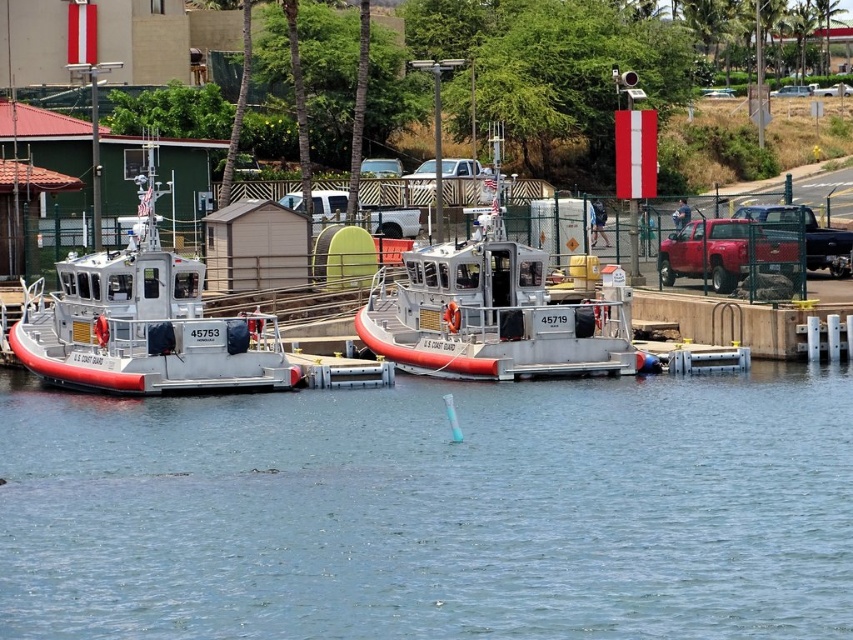
In the scene shown: You are a Coast Guard officer planning to move a 8.5 meter long cargo container between the white rubber boat at left and the white matte boat at center. Based on the distance between them, can the container fit through the space without needing to move either boat?

The white rubber boat at left and the white matte boat at center are 7.97 meters apart from each other. Since the cargo container is 8.5 meters long, it cannot fit through the space between them without moving at least one of the boats.

You are a Coast Guard officer planning to launch a boat from the pier. You need to choose between the white rubber boat at left and the white matte boat at center. Which boat should you choose if you need a larger vessel for a rescue operation?

The white matte boat at center is larger than the white rubber boat at left, so you should choose the white matte boat at center for the rescue operation.

You are a drone operator tasked with capturing aerial footage of the waterfront scene. The drone needs to hover above the transparent water at center to capture a clear reflection of the boats. Given that the drone is currently at coordinates point A, which is at point A coordinates are at point A coordinates are at point A coordinates are at point A coordinates are at point A coordinates are at point A coordinates are at point A coordinates are at point A coordinates are at point A coordinates are at point

The transparent water at center is located at point coordinates point coordinates are at point coordinates are at point coordinates are at point coordinates are at point coordinates are at point coordinates are at point coordinates are at point coordinates are at point coordinates are at point coordinates are at point coordinates are at point coordinates are at point coordinates are at point coordinates are at point coordinates are at point coordinates are at point coordinates are at point coordinates are